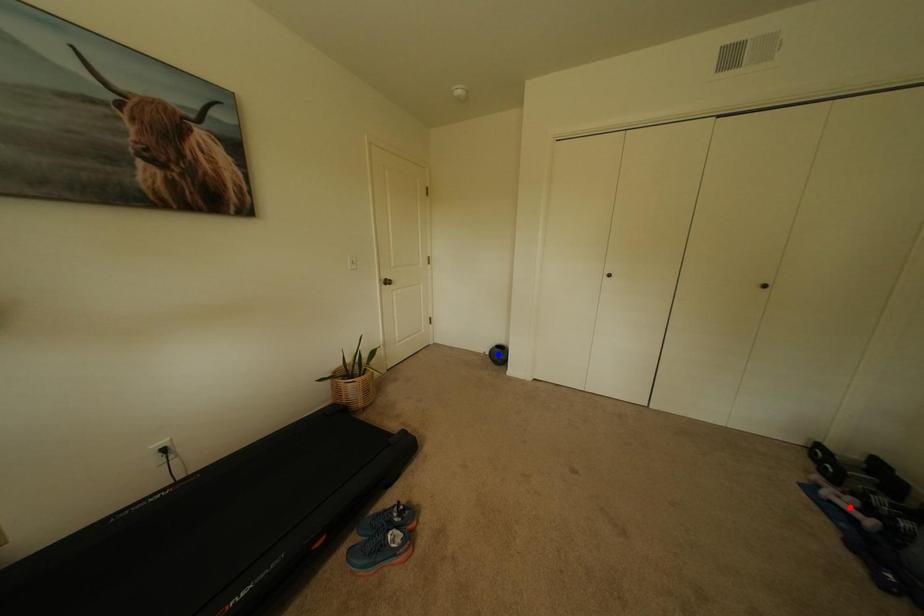
Question: Two points are marked on the image. Which point is closer to the camera?

Choices:
 (A) Blue point is closer.
 (B) Red point is closer.

Answer: (B)